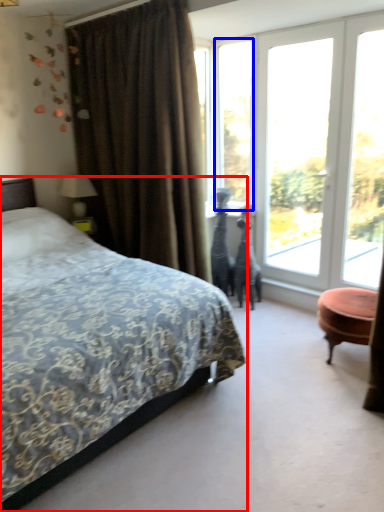
Question: Which point is closer to the camera, bed (highlighted by a red box) or window (highlighted by a blue box)?

Choices:
 (A) bed
 (B) window

Answer: (A)